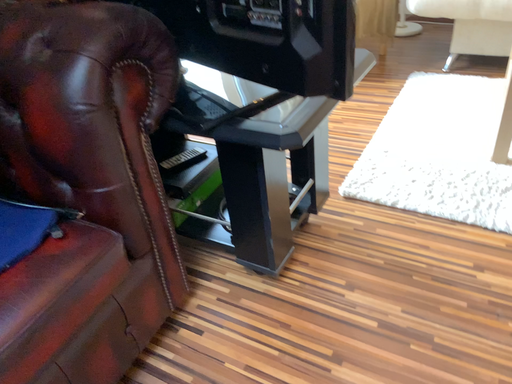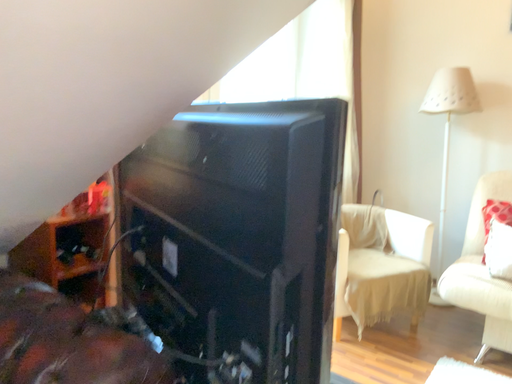
Question: How did the camera likely rotate when shooting the video?

Choices:
 (A) rotated downward
 (B) rotated upward

Answer: (B)